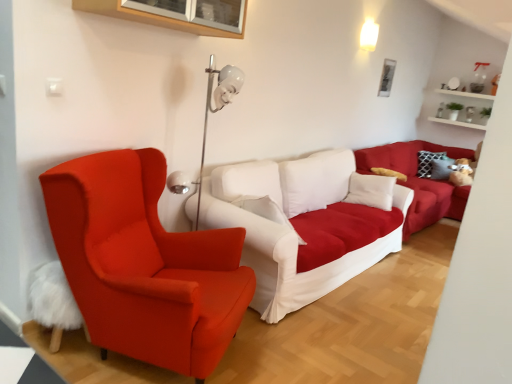
Question: Is matte orange armchair at left in front of or behind white fabric couch at center, the 2th studio couch viewed from the back, in the image?

Choices:
 (A) front
 (B) behind

Answer: (A)

Question: In terms of width, does matte orange armchair at left look wider or thinner when compared to white fabric couch at center, the 2th studio couch viewed from the back?

Choices:
 (A) thin
 (B) wide

Answer: (A)

Question: Considering the real-world distances, which object is farthest from the white wooden shelf at upper right?

Choices:
 (A) matte orange armchair at left
 (B) metallic silver picture frame at upper center
 (C) white fabric couch at center, the 1th studio couch from the back
 (D) white fabric couch at center, which ranks as the first studio couch in front-to-back order
 (E) matte white wall sconce at upper right

Answer: (A)

Question: Which object is the farthest from the white fabric couch at center, acting as the 2th studio couch starting from the front?

Choices:
 (A) metallic silver picture frame at upper center
 (B) white fabric couch at center, which ranks as the first studio couch in front-to-back order
 (C) matte white wall sconce at upper right
 (D) matte orange armchair at left
 (E) white wooden shelf at upper right

Answer: (D)